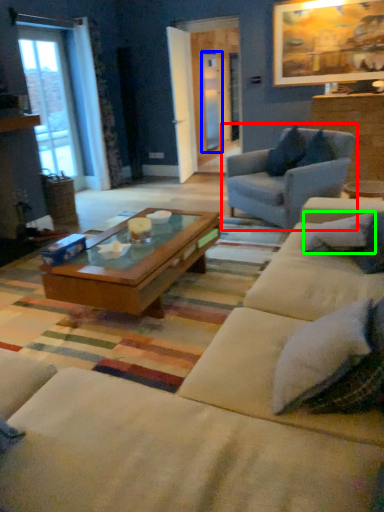
Question: Considering the real-world distances, which object is farthest from chair (highlighted by a red box)? screen door (highlighted by a blue box) or pillow (highlighted by a green box)?

Choices:
 (A) screen door
 (B) pillow

Answer: (A)